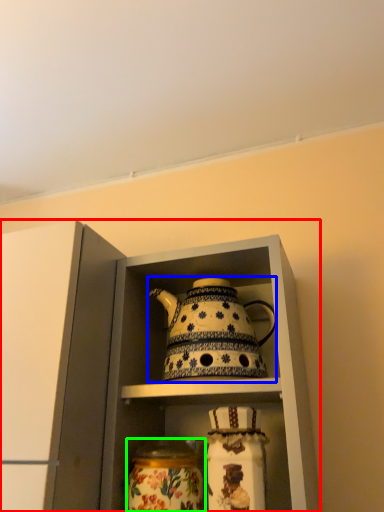
Question: Which is farther away from cabinetry (highlighted by a red box)? kettle (highlighted by a blue box) or glass vase (highlighted by a green box)?

Choices:
 (A) kettle
 (B) glass vase

Answer: (B)